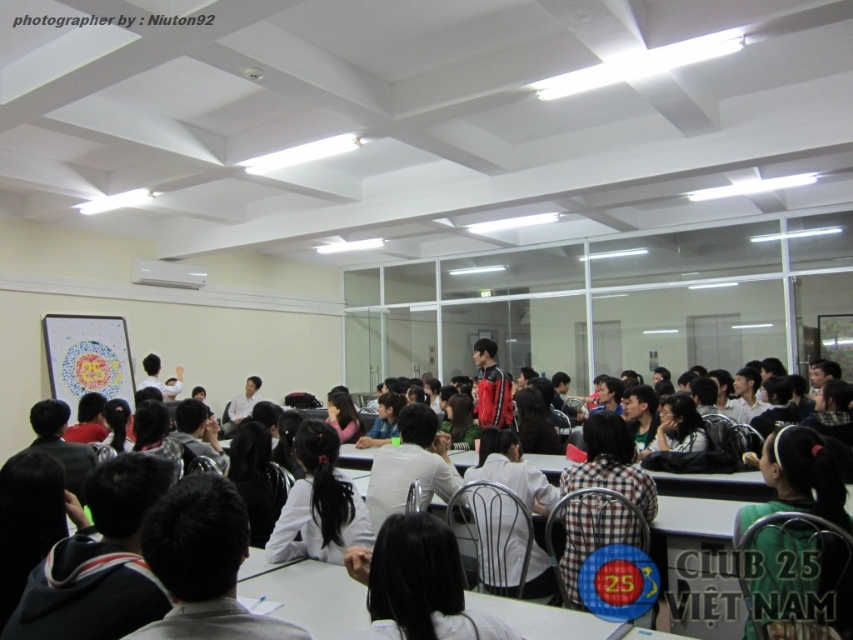
Question: Observing the image, what is the correct spatial positioning of matte black board at center in reference to white plastic table at center?

Choices:
 (A) above
 (B) below

Answer: (B)

Question: Does white matte jacket at center appear over red leather jacket at center?

Choices:
 (A) no
 (B) yes

Answer: (A)

Question: Is white matte jacket at center wider than red leather jacket at center?

Choices:
 (A) yes
 (B) no

Answer: (A)

Question: Which object is farther from the camera taking this photo?

Choices:
 (A) red leather jacket at center
 (B) black matte hair at center
 (C) white plastic table at center
 (D) green matte shirt at lower right

Answer: (A)

Question: Among these points, which one is nearest to the camera?

Choices:
 (A) (395, 566)
 (B) (703, 532)

Answer: (A)

Question: Which object appears closest to the camera in this image?

Choices:
 (A) black matte hair at center
 (B) white matte jacket at center
 (C) green matte shirt at lower right
 (D) white plastic table at center

Answer: (A)